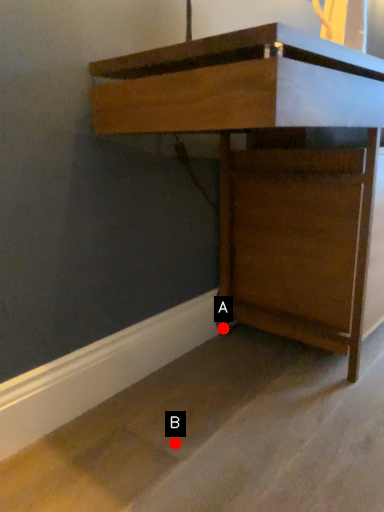
Question: Two points are circled on the image, labeled by A and B beside each circle. Among these points, which one is nearest to the camera?

Choices:
 (A) A is closer
 (B) B is closer

Answer: (B)